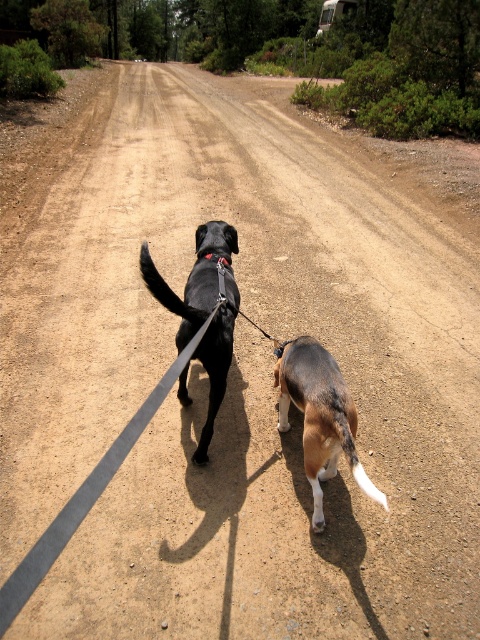
Question: Which point is farther to the camera?

Choices:
 (A) brown and white fur at center
 (B) shiny black dog at center

Answer: (B)

Question: Among these points, which one is nearest to the camera?

Choices:
 (A) (229, 284)
 (B) (286, 364)

Answer: (B)

Question: Does brown and white fur at center appear over shiny black dog at center?

Choices:
 (A) no
 (B) yes

Answer: (A)

Question: Does brown and white fur at center lie behind shiny black dog at center?

Choices:
 (A) no
 (B) yes

Answer: (A)

Question: Can you confirm if brown and white fur at center is smaller than shiny black dog at center?

Choices:
 (A) yes
 (B) no

Answer: (A)